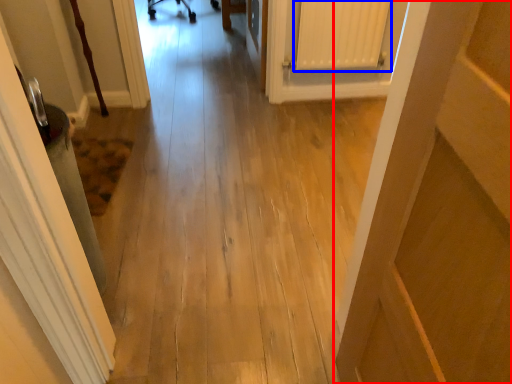
Question: Which object appears farthest to the camera in this image, door (highlighted by a red box) or radiator (highlighted by a blue box)?

Choices:
 (A) door
 (B) radiator

Answer: (B)